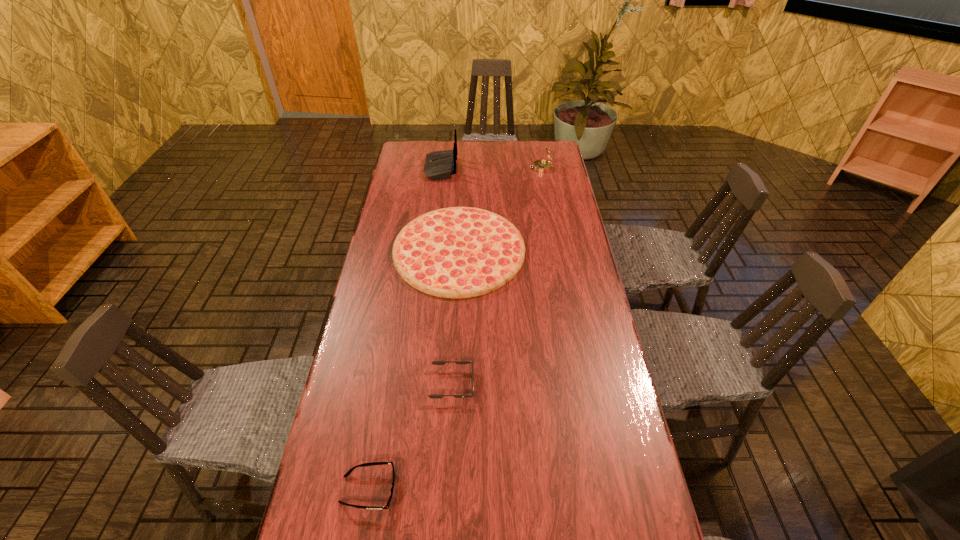
The image size is (960, 540). I want to click on free spot between the second tallest object and the nearer sunglasses, so click(455, 329).

Where is `vacant area between the nearest object and the rightmost object`? vacant area between the nearest object and the rightmost object is located at coordinates (455, 329).

The height and width of the screenshot is (540, 960). I want to click on free space between the tallest object and the nearer sunglasses, so click(404, 329).

The height and width of the screenshot is (540, 960). In order to click on vacant area that lies between the left sunglasses and the second tallest object in this screenshot , I will do `click(455, 329)`.

Locate an element on the screen. This screenshot has width=960, height=540. vacant space that's between the nearer sunglasses and the third farthest object is located at coordinates (414, 370).

At what (x,y) coordinates should I click in order to perform the action: click on free spot between the pizza and the nearer sunglasses. Please return your answer as a coordinate pair (x, y). Looking at the image, I should click on (414, 370).

At what (x,y) coordinates should I click in order to perform the action: click on the fourth closest object to the router. Please return your answer as a coordinate pair (x, y). This screenshot has width=960, height=540. Looking at the image, I should click on (348, 473).

The height and width of the screenshot is (540, 960). I want to click on object that can be found as the fourth closest to the compass, so click(x=348, y=473).

Image resolution: width=960 pixels, height=540 pixels. I want to click on free spot that satisfies the following two spatial constraints: 1. on the back of the tallest object; 2. on the back side of the third farthest object, so click(431, 251).

This screenshot has height=540, width=960. I want to click on vacant space that satisfies the following two spatial constraints: 1. on the back side of the pizza; 2. on the back of the router, so click(x=464, y=168).